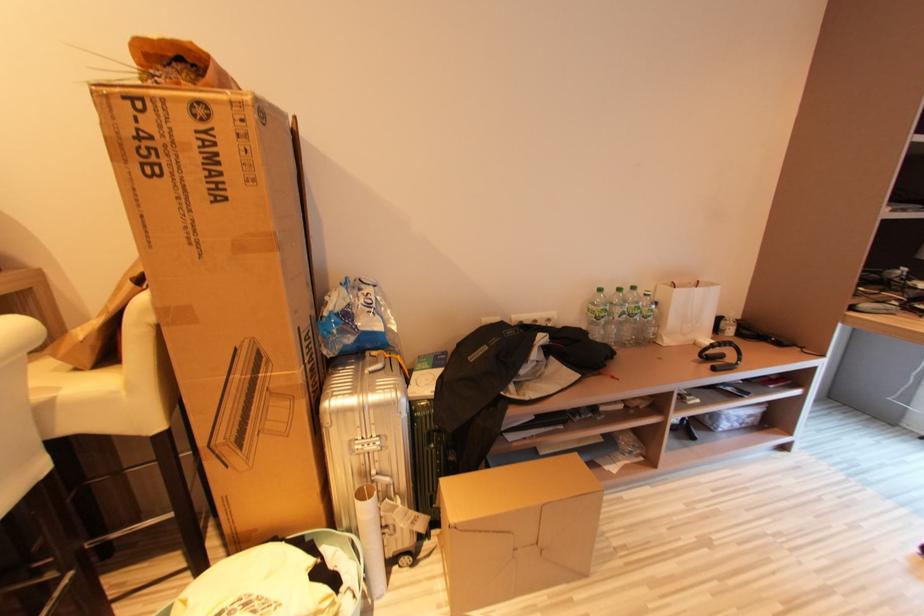
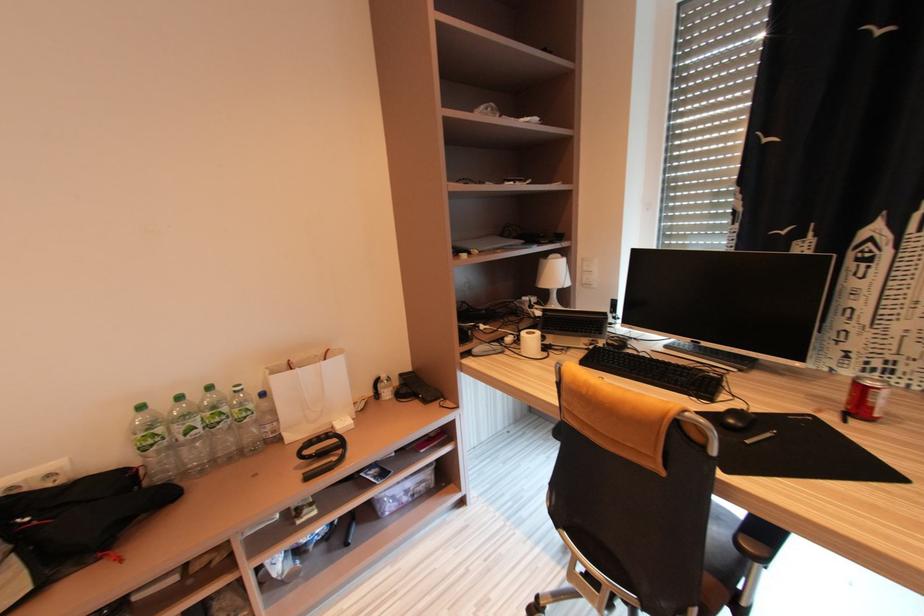
Question: The images are taken continuously from a first-person perspective. In which direction are you moving?

Choices:
 (A) Left
 (B) Right
 (C) Forward
 (D) Backward

Answer: (B)